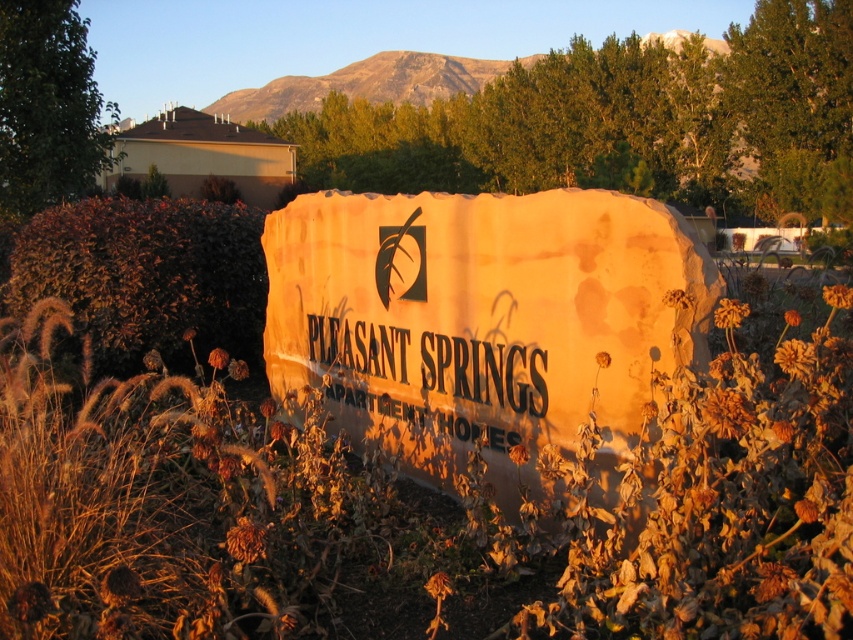
Between brown dried flower at center and matte stone sign at center, which one has more height?

Standing taller between the two is matte stone sign at center.

Between point (236, 566) and point (555, 353), which one is positioned behind?

Positioned behind is point (555, 353).

Locate an element on the screen. brown dried flower at center is located at coordinates (421, 513).

Is brown dried flower at center below black stone sign at center?

Indeed, brown dried flower at center is positioned under black stone sign at center.

Does point (540, 531) come farther from viewer compared to point (467, 429)?

No, it is in front of (467, 429).

The image size is (853, 640). What are the coordinates of `brown dried flower at center` in the screenshot? It's located at (421, 513).

Is matte stone sign at center smaller than black stone sign at center?

No, matte stone sign at center is not smaller than black stone sign at center.

Does point (527, 200) come farther from viewer compared to point (532, 376)?

Yes, it is.

Is point (601, 486) farther from viewer compared to point (526, 413)?

No, it is not.

Locate an element on the screen. The width and height of the screenshot is (853, 640). matte stone sign at center is located at coordinates (485, 321).